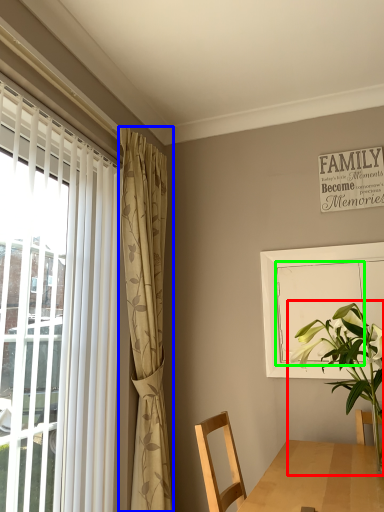
Question: Considering the real-world distances, which object is closest to houseplant (highlighted by a red box)? curtain (highlighted by a blue box) or screen door (highlighted by a green box).

Choices:
 (A) curtain
 (B) screen door

Answer: (B)